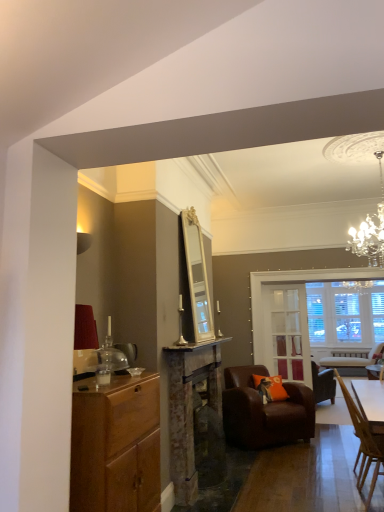
Question: Can you confirm if clear glass door at center is bigger than wooden chair at lower right, placed as the second chair when sorted from back to front?

Choices:
 (A) no
 (B) yes

Answer: (A)

Question: Would you say clear glass door at center contains wooden chair at lower right, placed as the second chair when sorted from back to front?

Choices:
 (A) no
 (B) yes

Answer: (A)

Question: Is clear glass door at center in front of wooden chair at lower right, placed as the second chair when sorted from back to front?

Choices:
 (A) yes
 (B) no

Answer: (B)

Question: Does clear glass door at center have a lesser height compared to wooden chair at lower right, which appears as the 1th chair when viewed from the front?

Choices:
 (A) yes
 (B) no

Answer: (B)

Question: Is there a large distance between clear glass door at center and wooden chair at lower right, placed as the second chair when sorted from back to front?

Choices:
 (A) yes
 (B) no

Answer: (A)

Question: Does clear glass door at center have a lesser width compared to wooden chair at lower right, which appears as the 1th chair when viewed from the front?

Choices:
 (A) yes
 (B) no

Answer: (A)

Question: Is orange fabric pillow at center directly adjacent to wooden cabinet at left?

Choices:
 (A) yes
 (B) no

Answer: (B)

Question: Can you confirm if orange fabric pillow at center is wider than wooden cabinet at left?

Choices:
 (A) yes
 (B) no

Answer: (B)

Question: Considering the relative sizes of orange fabric pillow at center and wooden cabinet at left in the image provided, is orange fabric pillow at center bigger than wooden cabinet at left?

Choices:
 (A) no
 (B) yes

Answer: (A)

Question: From a real-world perspective, is orange fabric pillow at center positioned over wooden cabinet at left based on gravity?

Choices:
 (A) no
 (B) yes

Answer: (A)

Question: Is orange fabric pillow at center shorter than wooden cabinet at left?

Choices:
 (A) no
 (B) yes

Answer: (B)

Question: Could you tell me if orange fabric pillow at center is turned towards wooden cabinet at left?

Choices:
 (A) yes
 (B) no

Answer: (A)

Question: Can you confirm if brown leather armchair at center, which is the second chair from front to back, is wider than wooden chair at lower right, placed as the second chair when sorted from back to front?

Choices:
 (A) no
 (B) yes

Answer: (B)